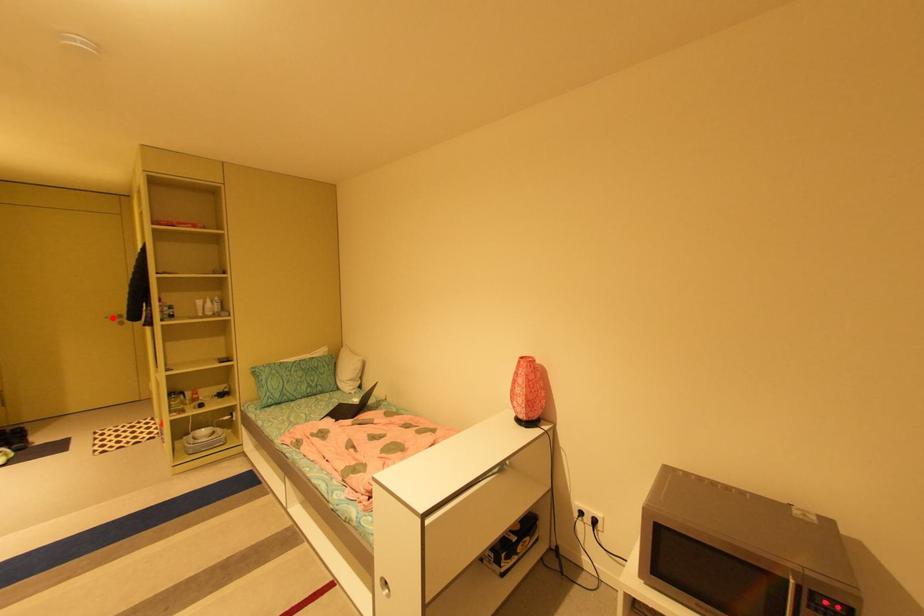
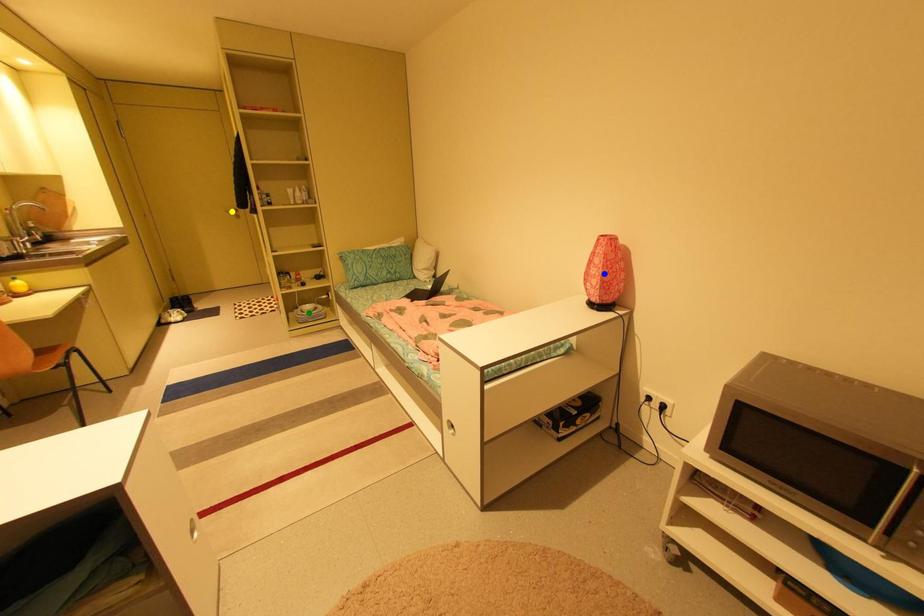
Question: I am providing you with two images of the same scene from different viewpoints. A red point is marked on the first image. You are given multiple points on the second image. Which point in image 2 represents the same 3d spot as the red point in image 1?

Choices:
 (A) yellow point
 (B) green point
 (C) blue point

Answer: (A)